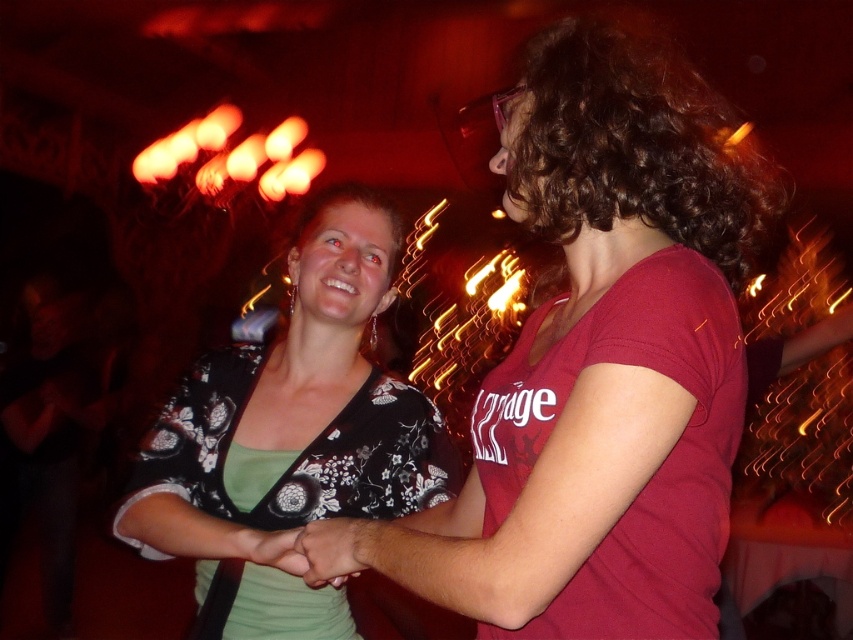
You are standing in the venue and want to take a photo of the point at coordinates (543, 204). The camera you have can focus on objects within 1 meter from the viewer. Will the point be in focus?

The point at coordinates (543, 204) is 96.50 centimeters from the viewer, which is within the camera focus range of 1 meter. Therefore, the point will be in focus.

You are at a club and want to find the person with dark brown curly hair at upper right. According to the image, where should you look relative to the other person in the scene?

The dark brown curly hair at upper right is located at point (633, 145), so you should look towards the upper right area relative to the other person in the scene.